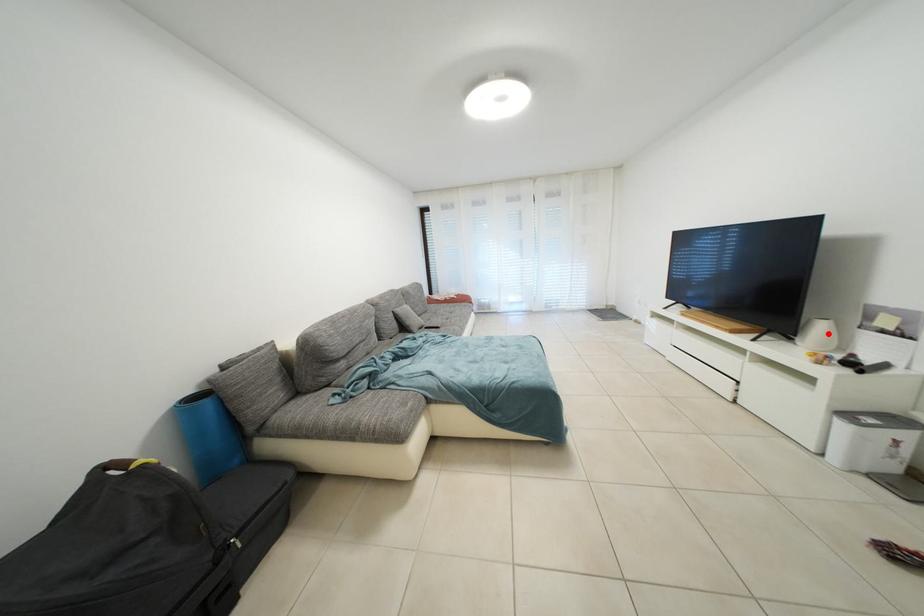
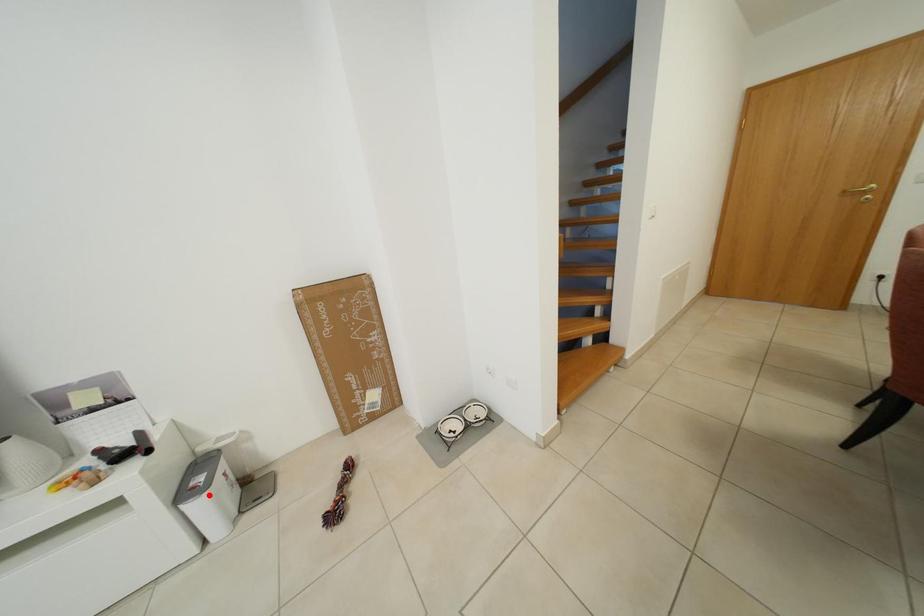
I am providing you with two images of the same scene from different viewpoints. A red point is marked on the first image and another point is marked on the second image. Is the red point in image1 aligned with the point shown in image2?

No